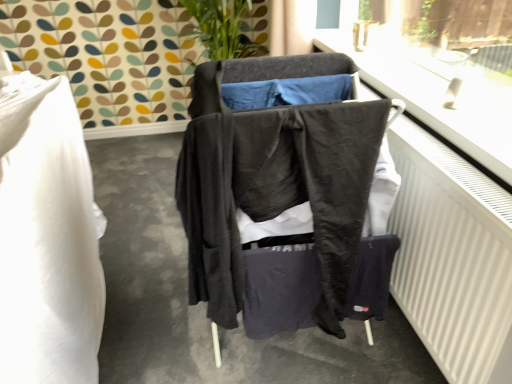
Question: Considering the positions of matte black clothing at center and white plastic window frame at upper right in the image, is matte black clothing at center bigger or smaller than white plastic window frame at upper right?

Choices:
 (A) big
 (B) small

Answer: (A)

Question: Is matte black clothing at center inside or outside of white plastic window frame at upper right?

Choices:
 (A) outside
 (B) inside

Answer: (A)

Question: Estimate the real-world distances between objects in this image. Which object is closer to the white matte radiator at right?

Choices:
 (A) white plastic window frame at upper right
 (B) matte black clothing at center
 (C) white fluffy pillow at left
 (D) dark gray fabric jacket at center

Answer: (A)

Question: Which of these objects is positioned closest to the dark gray fabric jacket at center?

Choices:
 (A) white fluffy pillow at left
 (B) matte black clothing at center
 (C) white matte radiator at right
 (D) white plastic window frame at upper right

Answer: (C)